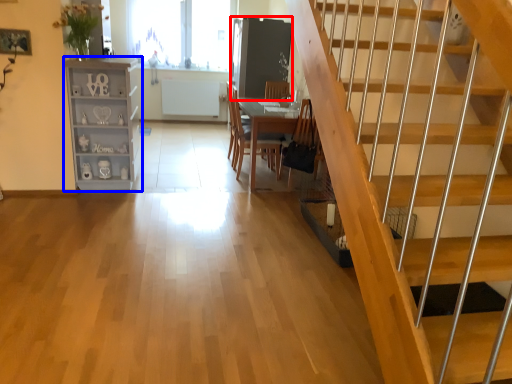
Question: Which of the following is the farthest to the observer, glass door (highlighted by a red box) or shelf (highlighted by a blue box)?

Choices:
 (A) glass door
 (B) shelf

Answer: (A)